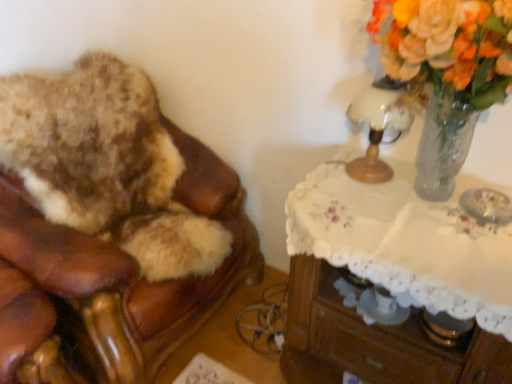
Question: Is translucent glass vase at upper right in contact with brown leather chair at left?

Choices:
 (A) yes
 (B) no

Answer: (B)

Question: Would you say translucent glass vase at upper right is a long distance from brown leather chair at left?

Choices:
 (A) no
 (B) yes

Answer: (B)

Question: From a real-world perspective, is translucent glass vase at upper right physically below brown leather chair at left?

Choices:
 (A) no
 (B) yes

Answer: (A)

Question: Can you confirm if translucent glass vase at upper right is bigger than brown leather chair at left?

Choices:
 (A) yes
 (B) no

Answer: (B)

Question: Does translucent glass vase at upper right appear on the right side of brown leather chair at left?

Choices:
 (A) yes
 (B) no

Answer: (A)

Question: Is brown leather chair at left situated inside translucent glass vase at upper right or outside?

Choices:
 (A) outside
 (B) inside

Answer: (A)

Question: From the image's perspective, is brown leather chair at left positioned above or below translucent glass vase at upper right?

Choices:
 (A) above
 (B) below

Answer: (B)

Question: From a real-world perspective, is brown leather chair at left above or below translucent glass vase at upper right?

Choices:
 (A) above
 (B) below

Answer: (B)

Question: Is brown leather chair at left bigger or smaller than translucent glass vase at upper right?

Choices:
 (A) big
 (B) small

Answer: (A)

Question: Relative to white lace-covered table at upper right, is translucent glass vase at upper right in front or behind?

Choices:
 (A) front
 (B) behind

Answer: (A)

Question: From a real-world perspective, relative to white lace-covered table at upper right, is translucent glass vase at upper right vertically above or below?

Choices:
 (A) below
 (B) above

Answer: (B)

Question: Is translucent glass vase at upper right taller or shorter than white lace-covered table at upper right?

Choices:
 (A) tall
 (B) short

Answer: (A)

Question: Looking at their shapes, would you say translucent glass vase at upper right is wider or thinner than white lace-covered table at upper right?

Choices:
 (A) thin
 (B) wide

Answer: (A)

Question: From the image's perspective, is translucent glass vase at upper right located above or below white glass table lamp at upper right?

Choices:
 (A) above
 (B) below

Answer: (A)

Question: Looking at their shapes, would you say translucent glass vase at upper right is wider or thinner than white glass table lamp at upper right?

Choices:
 (A) thin
 (B) wide

Answer: (B)